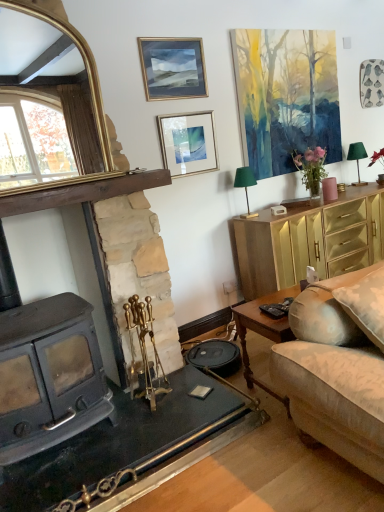
This screenshot has width=384, height=512. Identify the location of vacant space behind black plastic remote control at lower right. (263, 303).